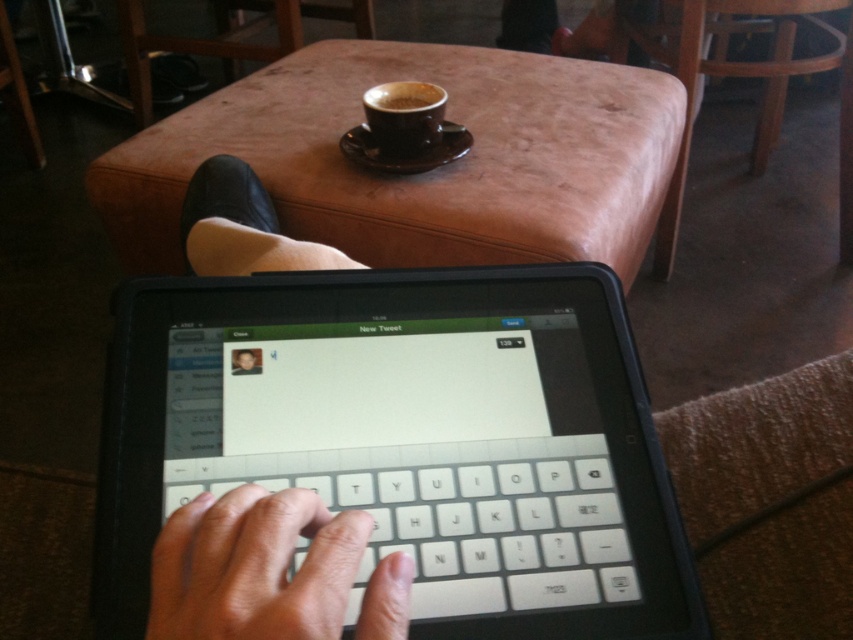
Question: Can you confirm if black ceramic cup at upper center is thinner than smooth skin face at center?

Choices:
 (A) yes
 (B) no

Answer: (B)

Question: Does light skin tone finger at center appear on the right side of shiny brown cup at center?

Choices:
 (A) no
 (B) yes

Answer: (A)

Question: Which point is farther to the camera?

Choices:
 (A) (372, 90)
 (B) (456, 582)
 (C) (419, 83)
 (D) (532, 593)

Answer: (C)

Question: Among these points, which one is farthest from the camera?

Choices:
 (A) (126, 380)
 (B) (408, 100)

Answer: (B)

Question: Among these points, which one is farthest from the camera?

Choices:
 (A) (585, 200)
 (B) (421, 106)
 (C) (418, 132)

Answer: (B)

Question: Is brown leather ottoman at upper center to the left of light skin tone finger at center from the viewer's perspective?

Choices:
 (A) no
 (B) yes

Answer: (A)